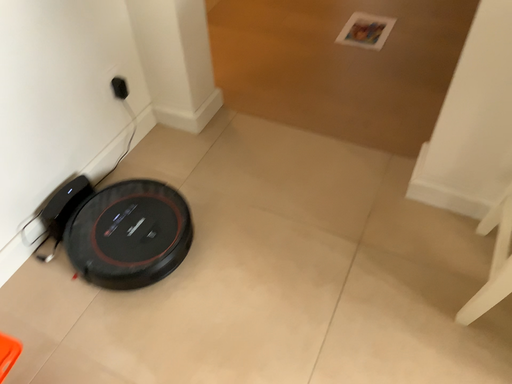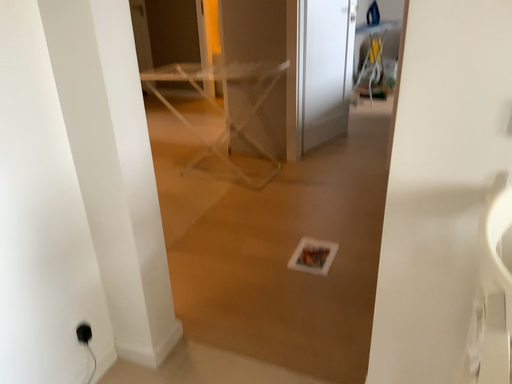
Question: Which way did the camera rotate in the video?

Choices:
 (A) rotated downward
 (B) rotated upward

Answer: (B)